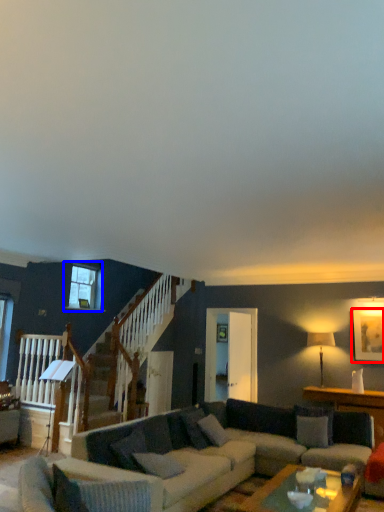
Question: Which object is closer to the camera taking this photo, picture frame (highlighted by a red box) or window (highlighted by a blue box)?

Choices:
 (A) picture frame
 (B) window

Answer: (A)